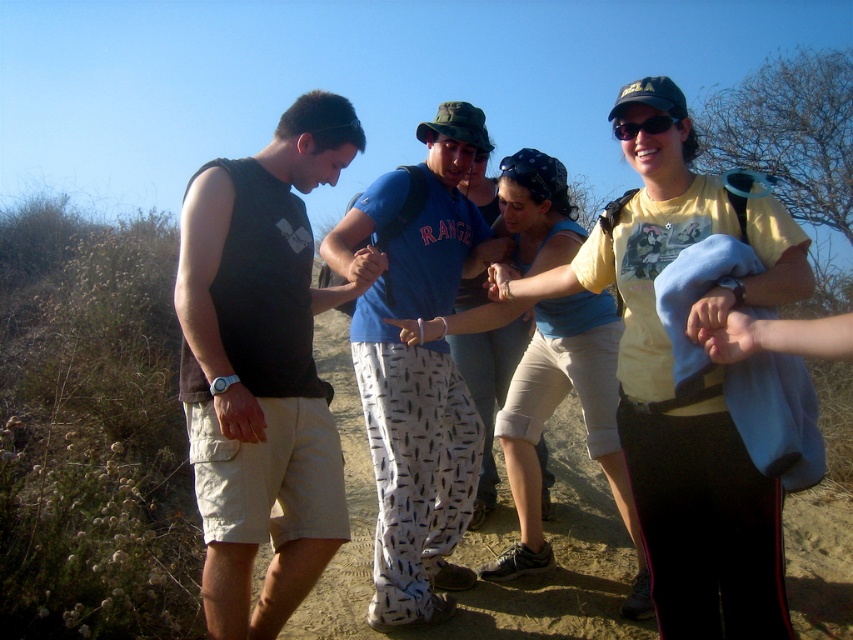
Who is positioned more to the left, yellow cotton t-shirt at center or blue cotton shirt at center?

Positioned to the left is blue cotton shirt at center.

Is yellow cotton t-shirt at center taller than blue cotton shirt at center?

Incorrect, yellow cotton t-shirt at center's height is not larger of blue cotton shirt at center's.

Is point (717, 294) positioned in front of point (389, 609)?

Yes, point (717, 294) is closer to viewer.

I want to click on yellow cotton t-shirt at center, so click(671, 396).

Can you confirm if matte black tank top at left is wider than yellow cotton t-shirt at center?

Incorrect, matte black tank top at left's width does not surpass yellow cotton t-shirt at center's.

Find the location of `matte black tank top at left`. matte black tank top at left is located at coordinates (260, 365).

Is point (669, 506) closer to viewer compared to point (666, 129)?

That is True.

Does point (640, 122) come in front of point (662, 118)?

No, (640, 122) is further to viewer.

Where is `yellow cotton t-shirt at center`? The image size is (853, 640). yellow cotton t-shirt at center is located at coordinates (671, 396).